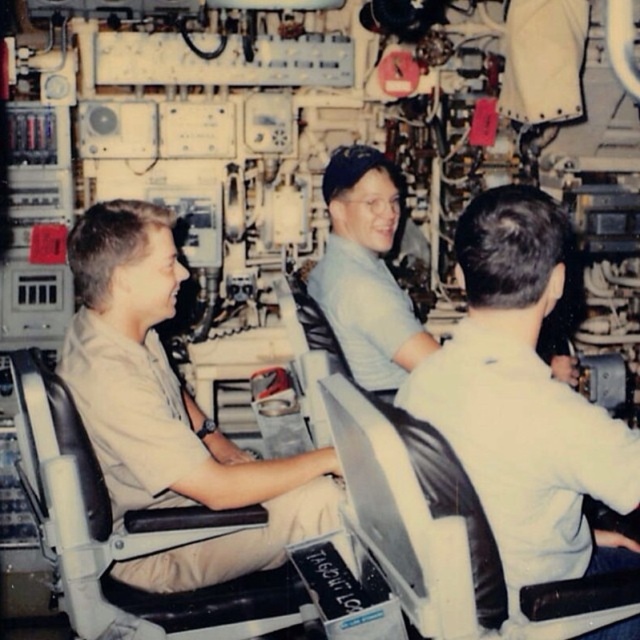
You are navigating through the submarine control room and need to reach the emergency exit located behind the light blue shirt at center. Can you pass behind the light brown uniform at left to get there?

The light brown uniform at left is in front of the light blue shirt at center, so you can pass behind the light brown uniform at left to reach the emergency exit behind the light blue shirt at center.

You are a new crew member entering the submarine control room. You need to find the black leather chair at left and the light blue shirt at center. Based on their sizes, which object would appear larger when viewed from your position at the entrance?

The light blue shirt at center appears larger than the black leather chair at left because the light blue shirt at center is taller than the black leather chair at left.

You are a crew member in the submarine control room and need to reach the black leather chair at center to adjust a nearby panel. Your white matte shirt at center is currently in your way. Can you move the shirt out of the way without leaving your current position?

The white matte shirt at center is only 7.73 inches away from the black leather chair at center, so you can easily move the shirt out of the way without needing to leave your position.